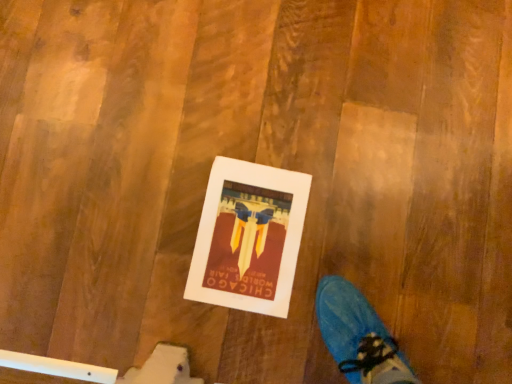
Find the location of a particular element. The height and width of the screenshot is (384, 512). free space to the back side of matte paper postcard at center is located at coordinates (292, 134).